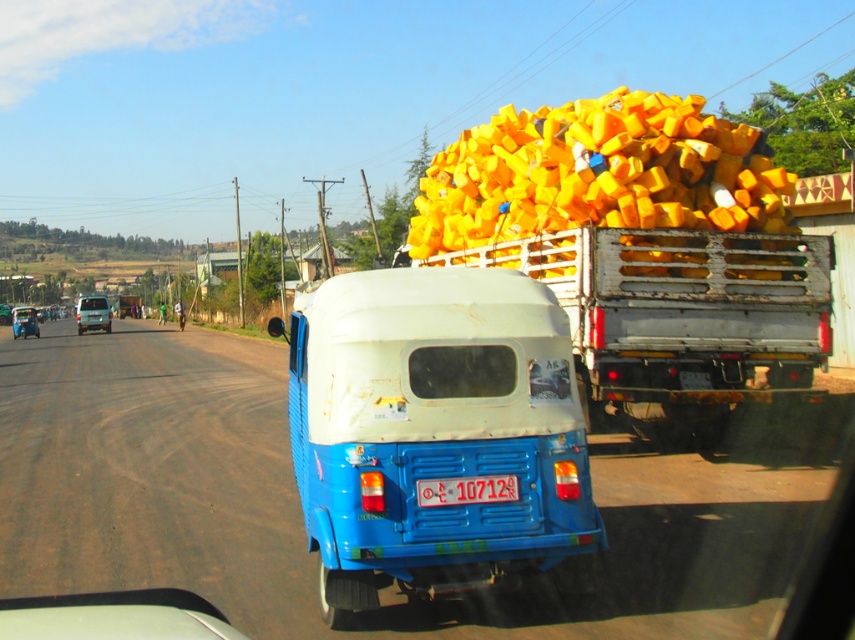
At what (x,y) coordinates should I click in order to perform the action: click on white matte auto rickshaw at center. Please return your answer as a coordinate pair (x, y). Looking at the image, I should click on (433, 429).

Between white matte auto rickshaw at center and yellow plastic containers at upper right, which one has less height?

With less height is yellow plastic containers at upper right.

Image resolution: width=855 pixels, height=640 pixels. Find the location of `white matte auto rickshaw at center`. white matte auto rickshaw at center is located at coordinates (433, 429).

How far apart are white matte auto rickshaw at center and rusty metal truck at right?

white matte auto rickshaw at center and rusty metal truck at right are 3.78 meters apart from each other.

Who is higher up, white matte auto rickshaw at center or rusty metal truck at right?

rusty metal truck at right is above.

Which is in front, point (373, 456) or point (777, 250)?

Point (373, 456) is more forward.

Where is `white matte auto rickshaw at center`? The image size is (855, 640). white matte auto rickshaw at center is located at coordinates (433, 429).

Between rusty metal truck at right and yellow plastic containers at upper right, which one is positioned higher?

yellow plastic containers at upper right is higher up.

This screenshot has width=855, height=640. Describe the element at coordinates (680, 317) in the screenshot. I see `rusty metal truck at right` at that location.

Does point (706, 442) come farther from viewer compared to point (694, 148)?

Yes, it is.

The height and width of the screenshot is (640, 855). Identify the location of rusty metal truck at right. (680, 317).